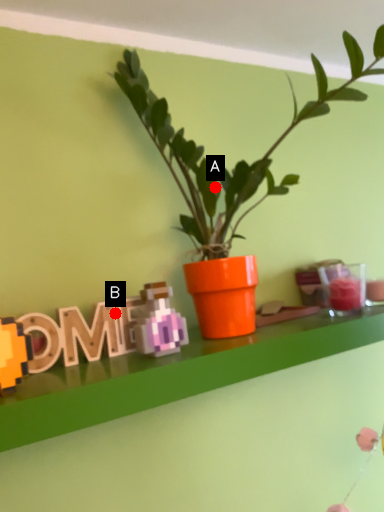
Question: Two points are circled on the image, labeled by A and B beside each circle. Which point is further to the camera?

Choices:
 (A) A is further
 (B) B is further

Answer: (A)